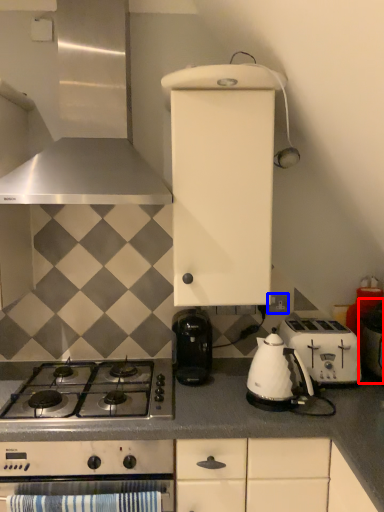
Question: Among these objects, which one is nearest to the camera, appliance (highlighted by a red box) or electric outlet (highlighted by a blue box)?

Choices:
 (A) appliance
 (B) electric outlet

Answer: (A)